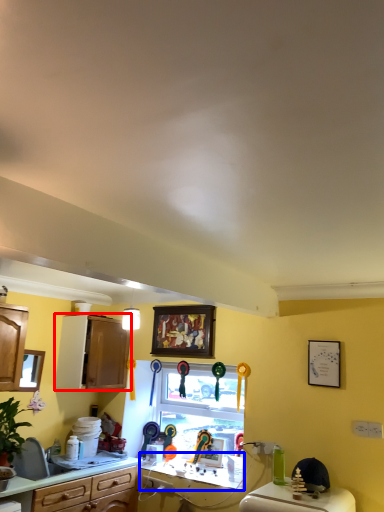
Question: Which object appears closest to the camera in this image, cabinetry (highlighted by a red box) or counter top (highlighted by a blue box)?

Choices:
 (A) cabinetry
 (B) counter top

Answer: (B)